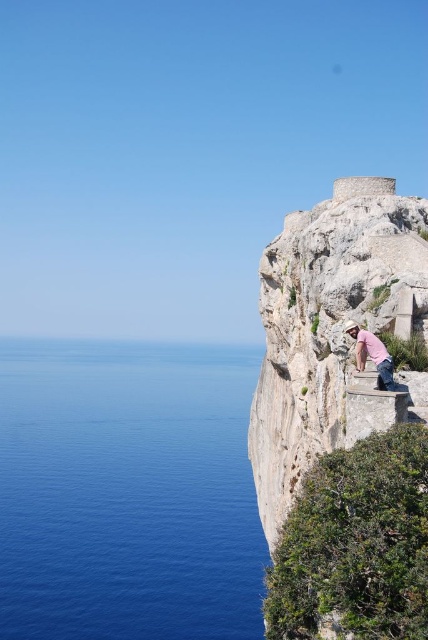
Question: Which of the following is the closest to the observer?

Choices:
 (A) pink cotton shirt at center
 (B) rough stone cliff at right

Answer: (B)

Question: Which point appears farthest from the camera in this image?

Choices:
 (A) (380, 358)
 (B) (53, 577)
 (C) (315, 227)

Answer: (B)

Question: Can you confirm if rough stone cliff at right is positioned below pink cotton shirt at center?

Choices:
 (A) yes
 (B) no

Answer: (A)

Question: Can you confirm if rough stone cliff at right is positioned below pink cotton shirt at center?

Choices:
 (A) no
 (B) yes

Answer: (B)

Question: Which object is farther from the camera taking this photo?

Choices:
 (A) rough stone cliff at right
 (B) pink cotton shirt at center

Answer: (B)

Question: Does blue water at left lie in front of rough stone cliff at right?

Choices:
 (A) yes
 (B) no

Answer: (B)